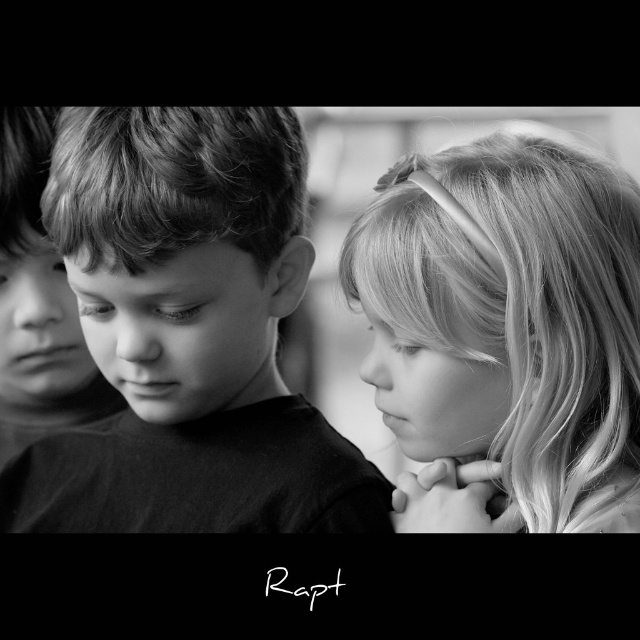
Question: Is smooth blonde hair at upper right in front of black matte boy at left?

Choices:
 (A) no
 (B) yes

Answer: (B)

Question: Estimate the real-world distances between objects in this image. Which object is farther from the black matte boy at left?

Choices:
 (A) black matte shirt at center
 (B) smooth blonde hair at upper right

Answer: (B)

Question: Which point appears farthest from the camera in this image?

Choices:
 (A) (44, 296)
 (B) (333, 484)
 (C) (508, 230)

Answer: (A)

Question: Is black matte shirt at center below smooth blonde hair at upper right?

Choices:
 (A) no
 (B) yes

Answer: (B)

Question: Is smooth blonde hair at upper right positioned before black matte boy at left?

Choices:
 (A) yes
 (B) no

Answer: (A)

Question: Estimate the real-world distances between objects in this image. Which object is farther from the smooth blonde hair at upper right?

Choices:
 (A) black matte shirt at center
 (B) black matte boy at left

Answer: (B)